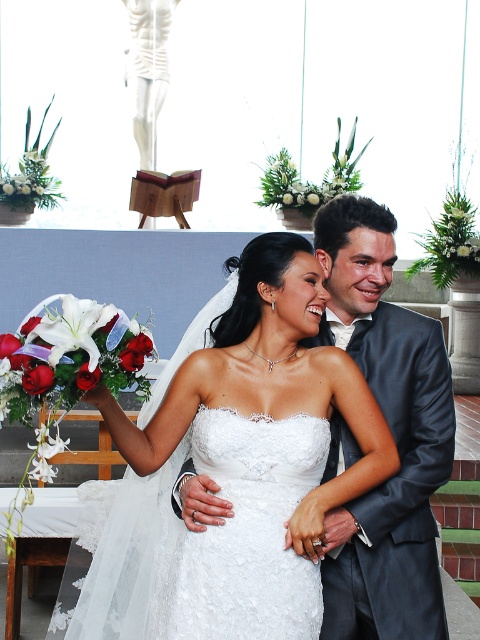
Question: Considering the real-world distances, which object is farthest from the white lace dress at center?

Choices:
 (A) white lace wedding dress at center
 (B) satin gray suit at right

Answer: (B)

Question: Among these objects, which one is farthest from the camera?

Choices:
 (A) satin gray suit at right
 (B) white lace wedding dress at center
 (C) white lace dress at center

Answer: (A)

Question: Can you confirm if white lace dress at center is bigger than satin gray suit at right?

Choices:
 (A) no
 (B) yes

Answer: (B)

Question: Which object is positioned farthest from the white lace wedding dress at center?

Choices:
 (A) white lace dress at center
 (B) satin gray suit at right

Answer: (B)

Question: Is white lace dress at center wider than white lace wedding dress at center?

Choices:
 (A) no
 (B) yes

Answer: (B)

Question: In this image, where is white lace dress at center located relative to satin gray suit at right?

Choices:
 (A) right
 (B) left

Answer: (B)